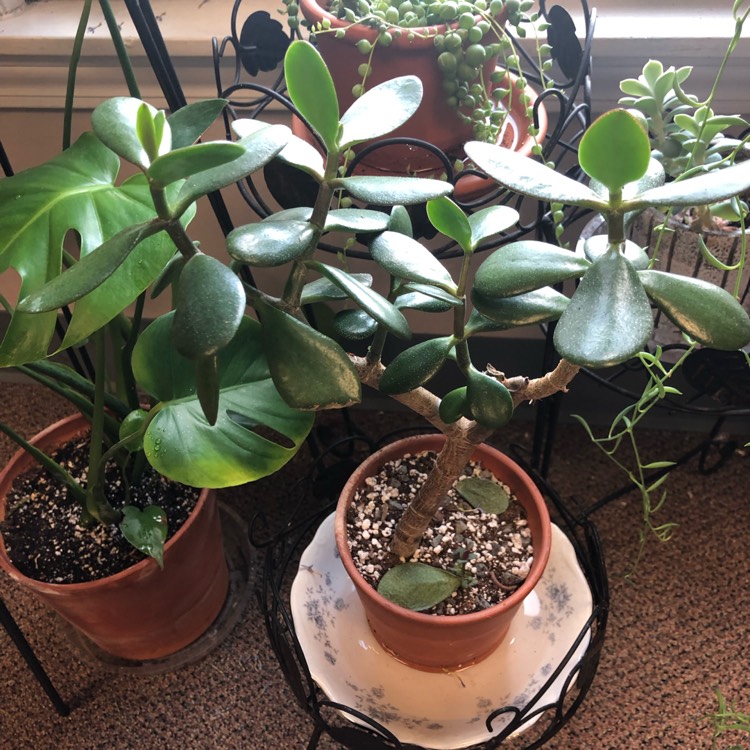
You are a GUI agent. You are given a task and a screenshot of the screen. Output one action in this format:
    pyautogui.click(x=<x>, y=<y>)
    Task: Click on the brown carpet
    The image size is (750, 750).
    Given the screenshot: What is the action you would take?
    pyautogui.click(x=693, y=566)